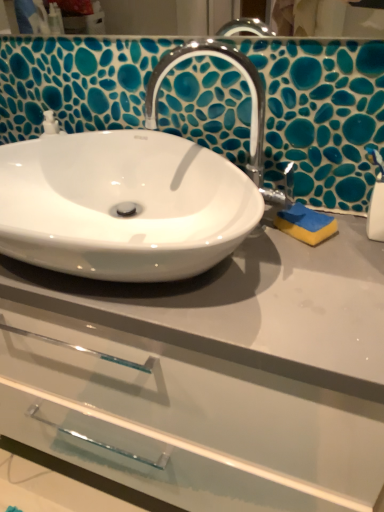
Question: Does yellow sponge at right lie in front of white glossy sink at center?

Choices:
 (A) no
 (B) yes

Answer: (A)

Question: Would you say yellow sponge at right contains white glossy sink at center?

Choices:
 (A) no
 (B) yes

Answer: (A)

Question: Is yellow sponge at right facing away from white glossy sink at center?

Choices:
 (A) no
 (B) yes

Answer: (A)

Question: Could you tell me if yellow sponge at right is facing white glossy sink at center?

Choices:
 (A) no
 (B) yes

Answer: (A)

Question: From a real-world perspective, is yellow sponge at right positioned over white glossy sink at center based on gravity?

Choices:
 (A) no
 (B) yes

Answer: (A)

Question: Is yellow sponge at right further to camera compared to white glossy sink at center?

Choices:
 (A) no
 (B) yes

Answer: (B)

Question: Is white plastic soap dispenser at right at the back of white glossy sink at center?

Choices:
 (A) yes
 (B) no

Answer: (B)

Question: Could you tell me if white glossy sink at center is facing white plastic soap dispenser at right?

Choices:
 (A) no
 (B) yes

Answer: (A)

Question: Is the surface of white glossy sink at center in direct contact with white plastic soap dispenser at right?

Choices:
 (A) no
 (B) yes

Answer: (A)

Question: Is white glossy sink at center taller than white plastic soap dispenser at right?

Choices:
 (A) yes
 (B) no

Answer: (B)

Question: Considering the relative sizes of white glossy sink at center and white plastic soap dispenser at right in the image provided, is white glossy sink at center shorter than white plastic soap dispenser at right?

Choices:
 (A) no
 (B) yes

Answer: (B)

Question: Considering the relative positions of white glossy sink at center and white plastic soap dispenser at right in the image provided, is white glossy sink at center behind white plastic soap dispenser at right?

Choices:
 (A) yes
 (B) no

Answer: (B)

Question: Would you say white glossy sink at center is a long distance from yellow sponge at right?

Choices:
 (A) no
 (B) yes

Answer: (A)